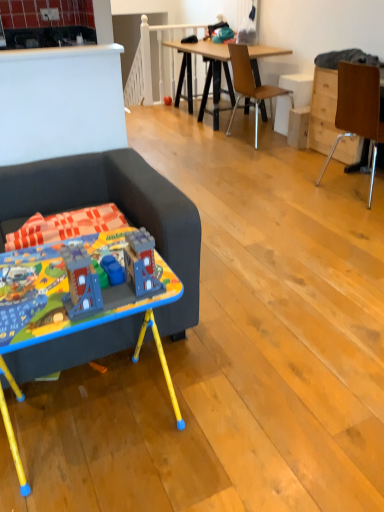
Locate an element on the screen. The image size is (384, 512). vacant space that's between blue plastic desk at lower left and wooden chair at right, which is counted as the second chair, starting from the left is located at coordinates (281, 266).